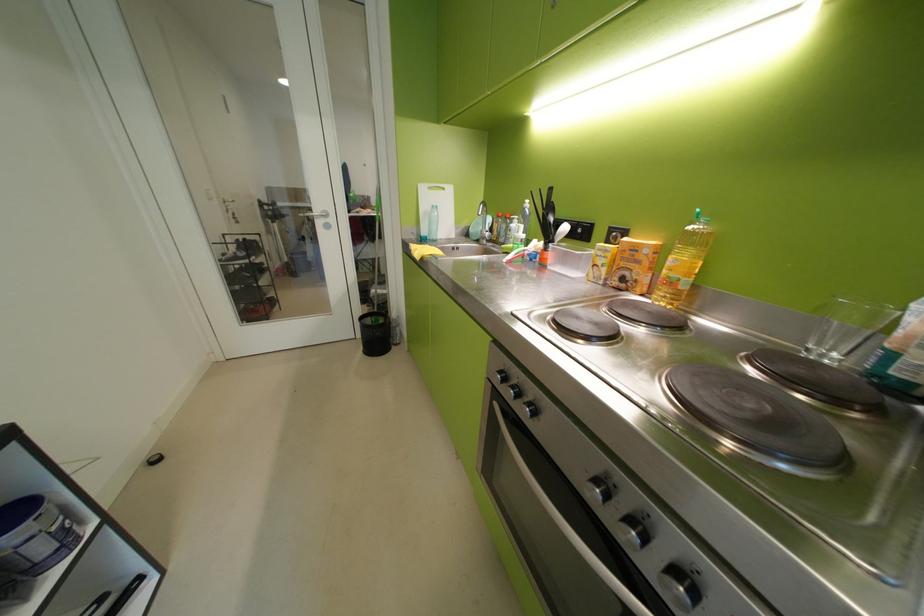
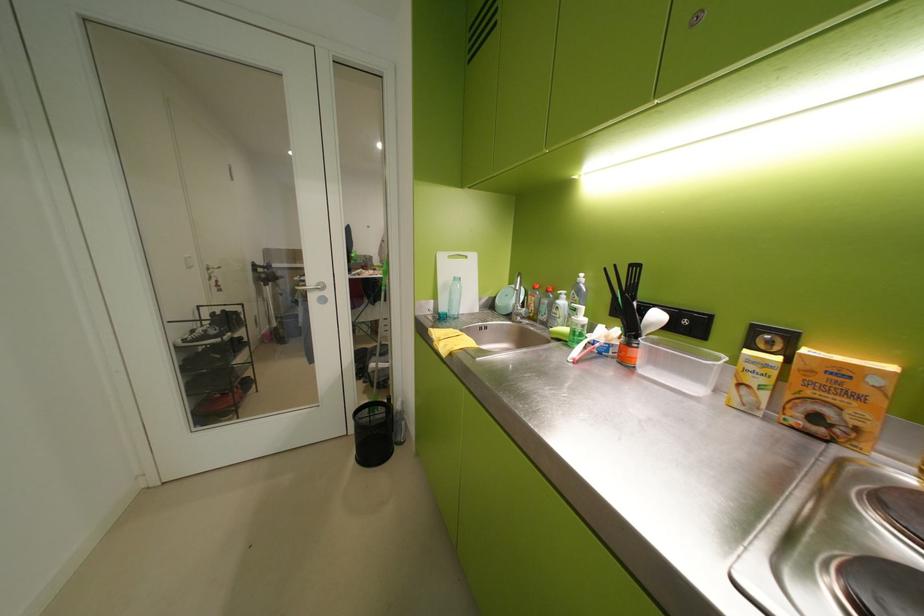
Find the pixel in the second image that matches [561,256] in the first image.

(650, 354)